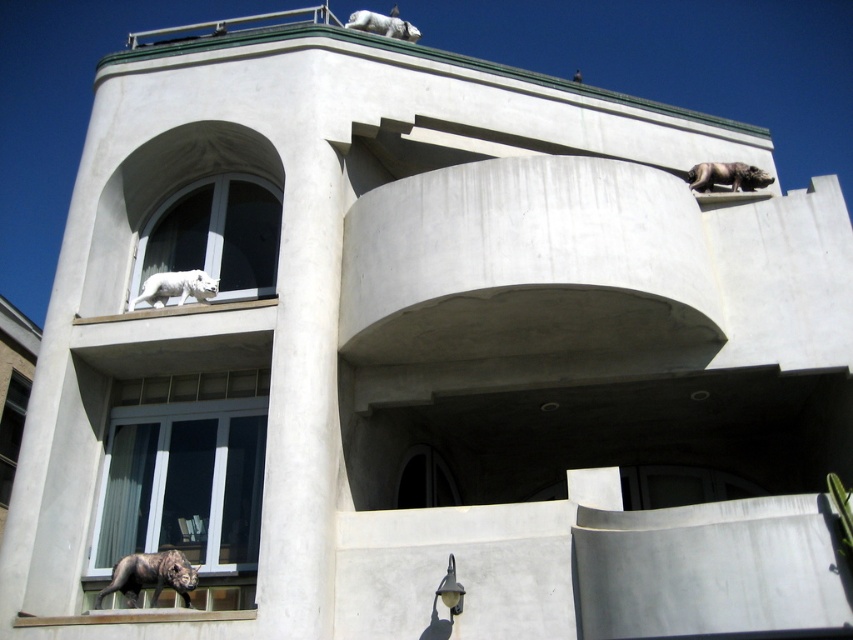
You are standing at the entrance of the building and want to locate the gray stone elephant at upper right. According to the coordinates provided, where should you look to find it?

The gray stone elephant at upper right is located at point (727, 177).

You are standing 30 meters away from the building. Can you reach the point marked at coordinates point [723,172] without moving closer to the building?

The point marked at coordinates point [723,172] is 34.29 meters away from the viewer. Since you are currently 30 meters away, you need to move 4.29 meters closer to reach that point.

You are an architect reviewing the design of the modern building. You notice the gray stone elephant at upper right and the white marble tiger at upper center. Which of these two sculptures takes up more space in the building design?

The white marble tiger at upper center occupies more space than the gray stone elephant at upper right.